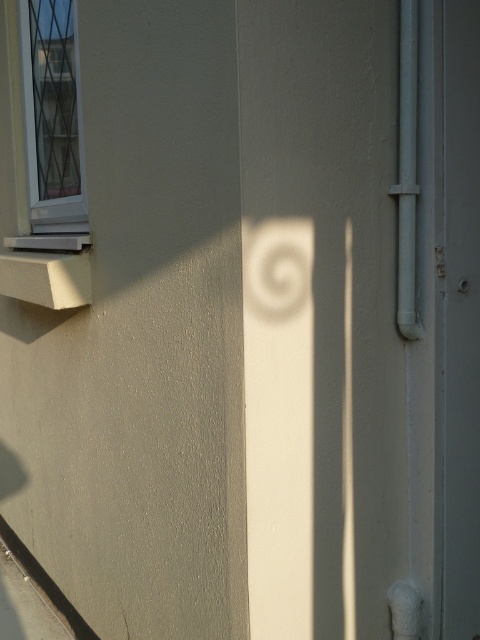
Does smooth gray pipe at right appear over white matte plaster bandage at lower right?

Yes.

Is smooth gray pipe at right to the left of white matte plaster bandage at lower right from the viewer's perspective?

Correct, you'll find smooth gray pipe at right to the left of white matte plaster bandage at lower right.

Is point (409, 140) positioned behind point (411, 624)?

No, it is in front of (411, 624).

The height and width of the screenshot is (640, 480). I want to click on smooth gray pipe at right, so click(x=407, y=172).

Can you confirm if white plastic window at upper left is smaller than white matte plaster bandage at lower right?

No, white plastic window at upper left is not smaller than white matte plaster bandage at lower right.

Who is more distant from viewer, (24, 97) or (396, 600)?

The point (24, 97) is more distant.

This screenshot has width=480, height=640. I want to click on white plastic window at upper left, so click(x=52, y=116).

Is white plastic window at upper left to the right of smooth gray pipe at right from the viewer's perspective?

Incorrect, white plastic window at upper left is not on the right side of smooth gray pipe at right.

Is white plastic window at upper left to the left of smooth gray pipe at right from the viewer's perspective?

Correct, you'll find white plastic window at upper left to the left of smooth gray pipe at right.

Looking at this image, who is more distant from viewer, (x=73, y=170) or (x=409, y=218)?

Point (x=73, y=170)

Identify the location of white plastic window at upper left. (52, 116).